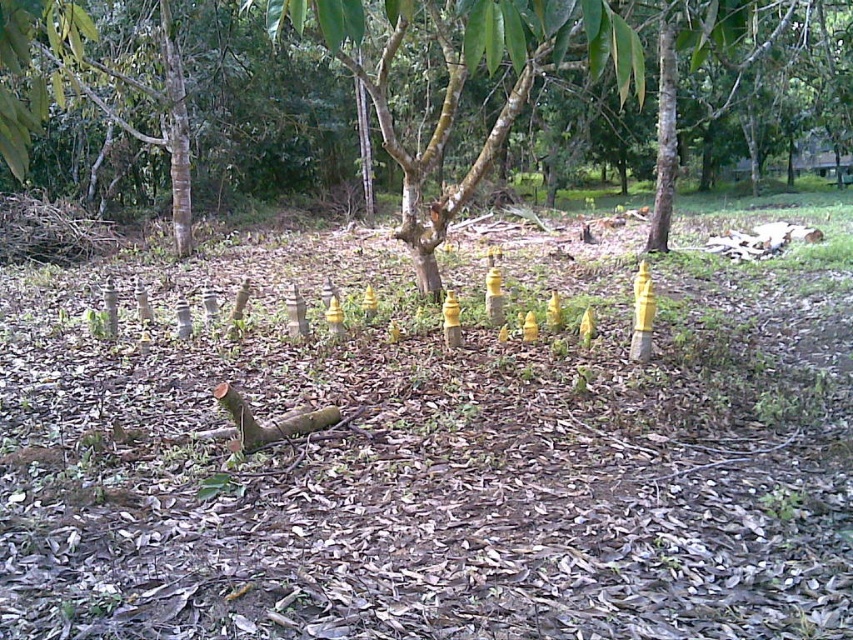
Question: Among these objects, which one is farthest from the camera?

Choices:
 (A) yellow matte tree at center
 (B) brown rough log at center
 (C) smooth bark tree at center

Answer: (B)

Question: Which of these objects is positioned farthest from the smooth bark tree at center?

Choices:
 (A) yellow matte cone at center
 (B) yellow matte tree at center

Answer: (A)

Question: Which of the following is the farthest from the observer?

Choices:
 (A) (614, 125)
 (B) (532, 314)
 (C) (430, 272)
 (D) (289, 436)

Answer: (A)

Question: Does smooth bark tree at center have a larger size compared to brown rough log at center?

Choices:
 (A) yes
 (B) no

Answer: (A)

Question: Is the position of brown rough log at center more distant than that of yellow matte cone at center?

Choices:
 (A) yes
 (B) no

Answer: (B)

Question: Does yellow matte tree at center appear over yellow matte cone at center?

Choices:
 (A) no
 (B) yes

Answer: (B)